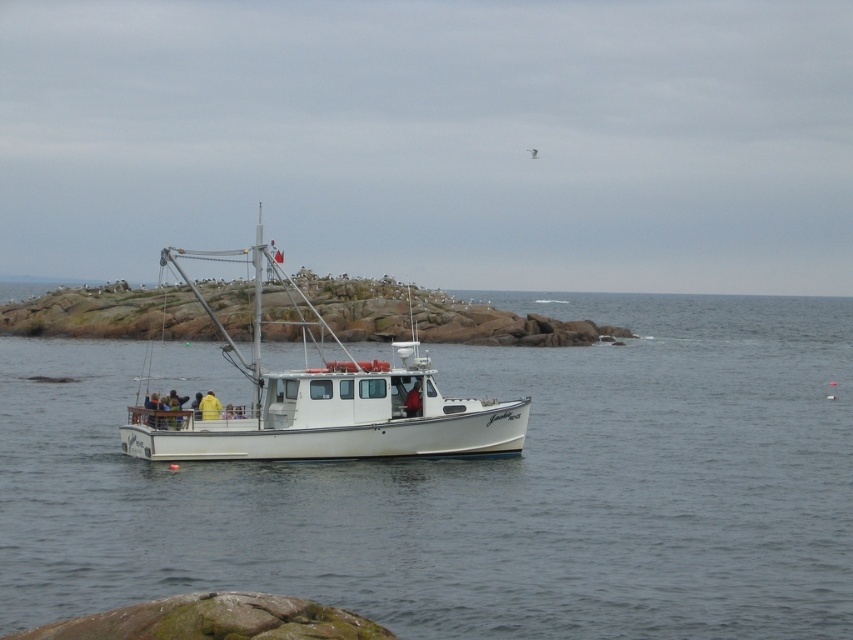
Question: Is clear water at center smaller than white matte boat at center?

Choices:
 (A) yes
 (B) no

Answer: (B)

Question: Does clear water at center have a smaller size compared to white matte boat at center?

Choices:
 (A) no
 (B) yes

Answer: (A)

Question: Which of the following is the closest to the observer?

Choices:
 (A) clear water at center
 (B) white matte boat at center

Answer: (A)

Question: Does clear water at center have a smaller size compared to white matte boat at center?

Choices:
 (A) yes
 (B) no

Answer: (B)

Question: Which point is farther to the camera?

Choices:
 (A) clear water at center
 (B) white matte boat at center

Answer: (B)

Question: Which of the following is the farthest from the observer?

Choices:
 (A) clear water at center
 (B) white matte boat at center

Answer: (B)